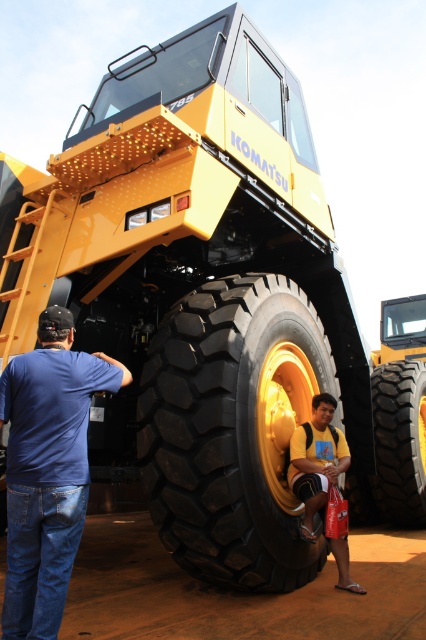
You are a safety inspector checking the Komatsu 785 mining truck. You notice the black rubber tire at center and the yellow cotton shirt at lower center. Which object is positioned to the left of the other?

The black rubber tire at center is to the left of the yellow cotton shirt at lower center.

You are a mechanic inspecting the Komatsu 785 mining truck. You notice two tires labeled black rubber tire at center and black rubber tire at lower center. Which tire would you need to check first if you suspect uneven wear, and why?

You should check the black rubber tire at center first because it is bigger than the black rubber tire at lower center, which might indicate uneven wear or inflation issues.

You are a safety inspector checking the Komatsu 785 mining truck. You notice the black rubber tire at lower center and the yellow cotton shirt at lower center. Which object is located below the other?

The black rubber tire at lower center is positioned under yellow cotton shirt at lower center, so the tire is below the shirt.